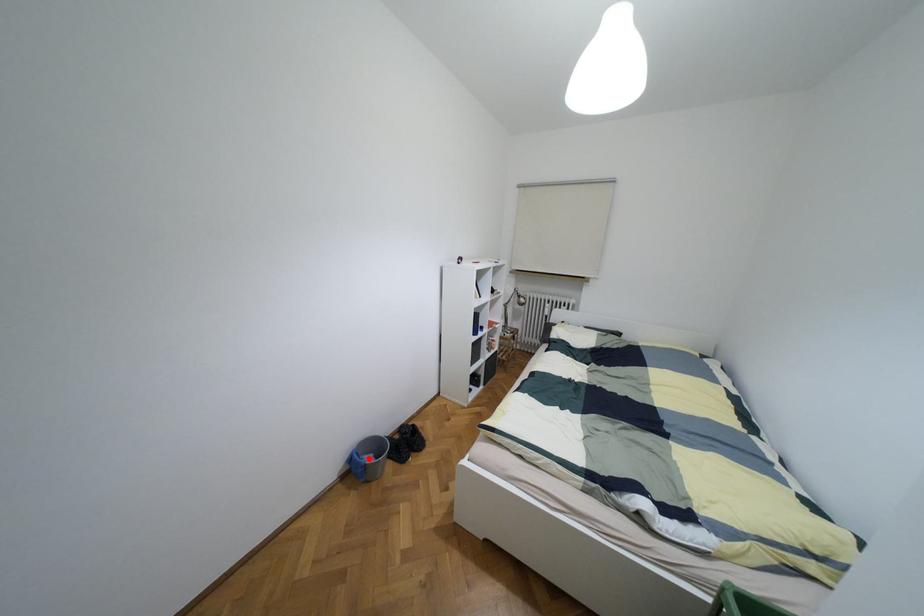
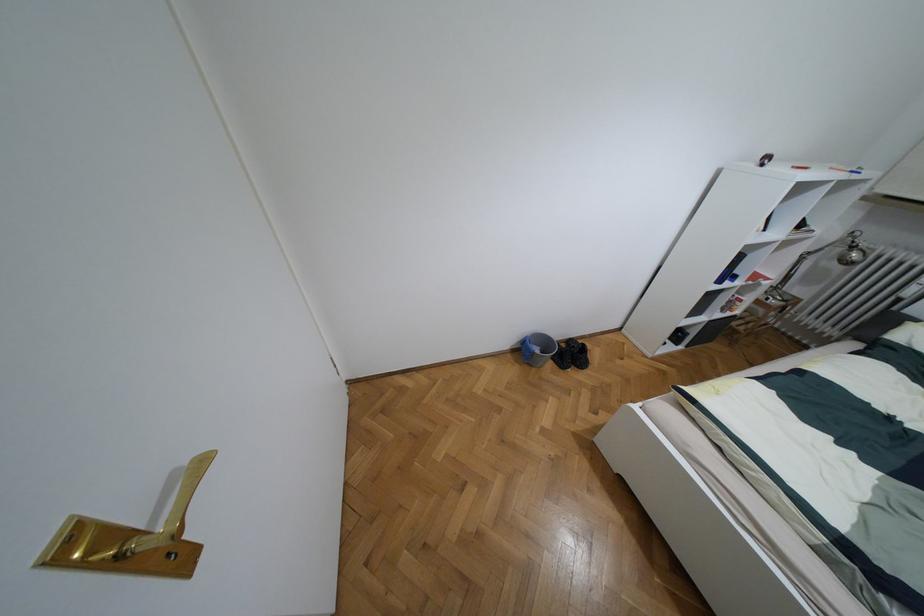
In the second image, find the point that corresponds to the highlighted location in the first image.

(536, 350)